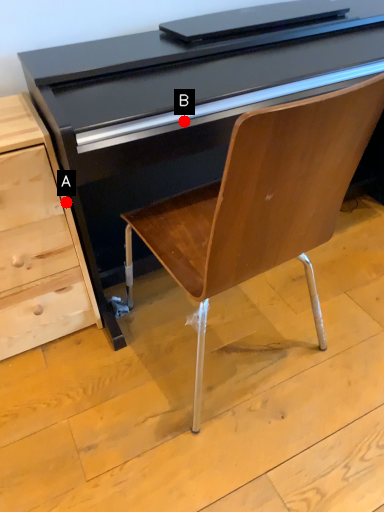
Question: Two points are circled on the image, labeled by A and B beside each circle. Which point is farther from the camera taking this photo?

Choices:
 (A) A is further
 (B) B is further

Answer: (A)